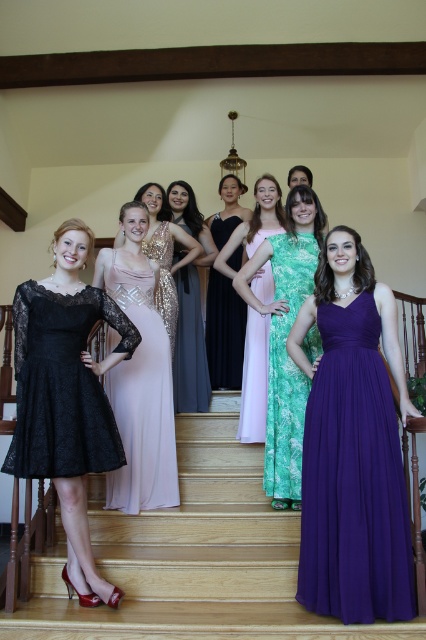
Question: Which object is positioned farthest from the lace fabric dress at lower left?

Choices:
 (A) light pink sequined dress at center
 (B) gold sequined dress at center
 (C) satin sequined dress at center
 (D) lace black dress at left

Answer: (B)

Question: Does light pink sequined dress at center appear on the left side of gold sequined dress at center?

Choices:
 (A) no
 (B) yes

Answer: (B)

Question: Does lace black dress at left have a smaller size compared to black satin dress at center?

Choices:
 (A) no
 (B) yes

Answer: (B)

Question: Is black satin dress at center above sequin dress at center?

Choices:
 (A) yes
 (B) no

Answer: (B)

Question: Which point is farther from the camera taking this photo?

Choices:
 (A) (170, 257)
 (B) (146, 456)
 (C) (252, 346)
 (D) (199, 330)

Answer: (D)

Question: Which of these objects is positioned farthest from the gold sequined dress at center?

Choices:
 (A) purple chiffon dress at center
 (B) light pink satin dress at center

Answer: (A)